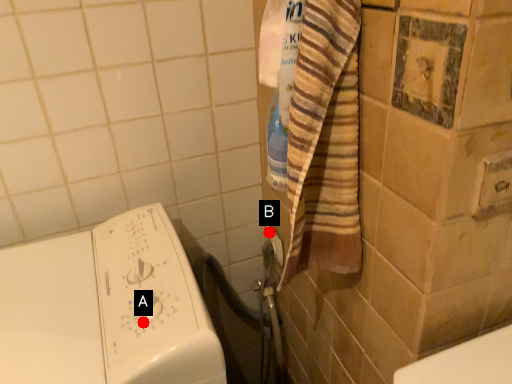
Question: Two points are circled on the image, labeled by A and B beside each circle. Which point is closer to the camera taking this photo?

Choices:
 (A) A is closer
 (B) B is closer

Answer: (A)